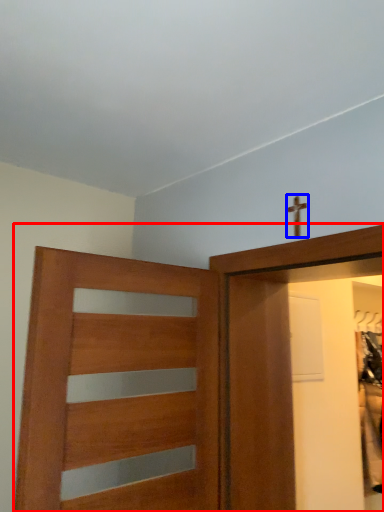
Question: Which object is closer to the camera taking this photo, door (highlighted by a red box) or crucifix (highlighted by a blue box)?

Choices:
 (A) door
 (B) crucifix

Answer: (A)